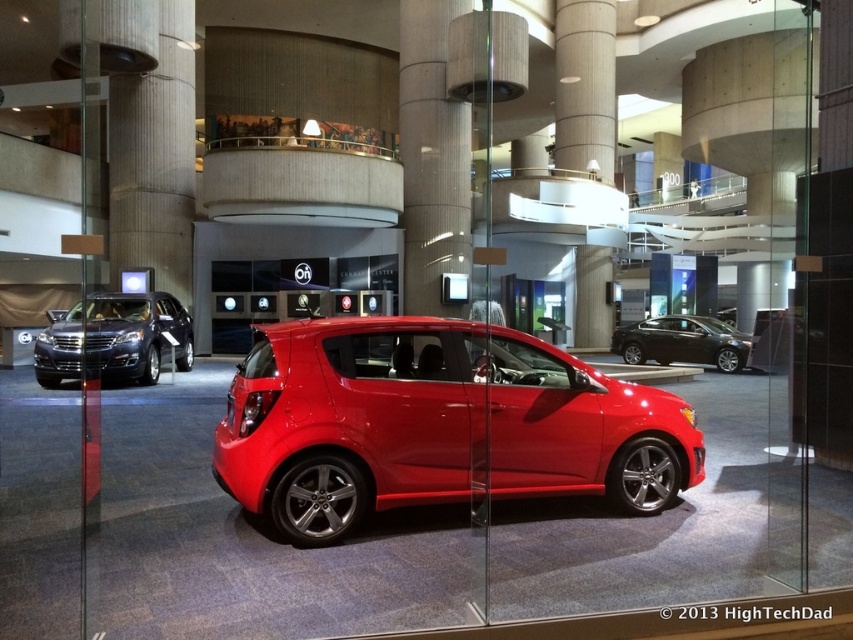
Between glossy red hatchback at center and glossy black sedan at center, which one appears on the right side from the viewer's perspective?

From the viewer's perspective, glossy black sedan at center appears more on the right side.

Is the position of glossy red hatchback at center more distant than that of glossy black sedan at center?

No.

Which is behind, point (529, 392) or point (712, 317)?

Positioned behind is point (712, 317).

At what (x,y) coordinates should I click in order to perform the action: click on glossy red hatchback at center. Please return your answer as a coordinate pair (x, y). Looking at the image, I should click on (436, 422).

Between glossy red hatchback at center and shiny black suv at left, which one appears on the left side from the viewer's perspective?

shiny black suv at left is more to the left.

Can you confirm if glossy red hatchback at center is positioned above shiny black suv at left?

No.

At what (x,y) coordinates should I click in order to perform the action: click on glossy red hatchback at center. Please return your answer as a coordinate pair (x, y). Looking at the image, I should click on point(436,422).

Where is `glossy red hatchback at center`? The width and height of the screenshot is (853, 640). glossy red hatchback at center is located at coordinates pyautogui.click(x=436, y=422).

Is shiny black suv at left closer to camera compared to glossy black sedan at center?

Yes, it is.

Who is lower down, shiny black suv at left or glossy black sedan at center?

glossy black sedan at center

Where is `shiny black suv at left`? The width and height of the screenshot is (853, 640). shiny black suv at left is located at coordinates (135, 333).